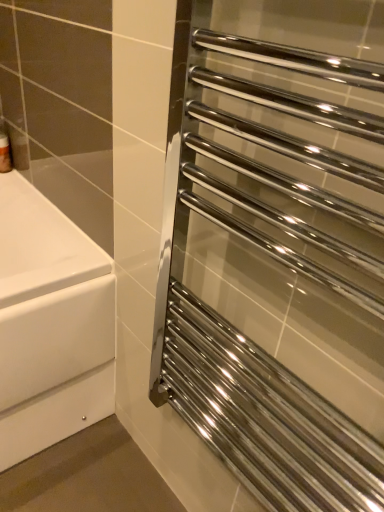
Describe the element at coordinates (282, 251) in the screenshot. I see `polished chrome towel rack at right` at that location.

Locate an element on the screen. polished chrome towel rack at right is located at coordinates (282, 251).

The width and height of the screenshot is (384, 512). What are the coordinates of `polished chrome towel rack at right` in the screenshot? It's located at (282, 251).